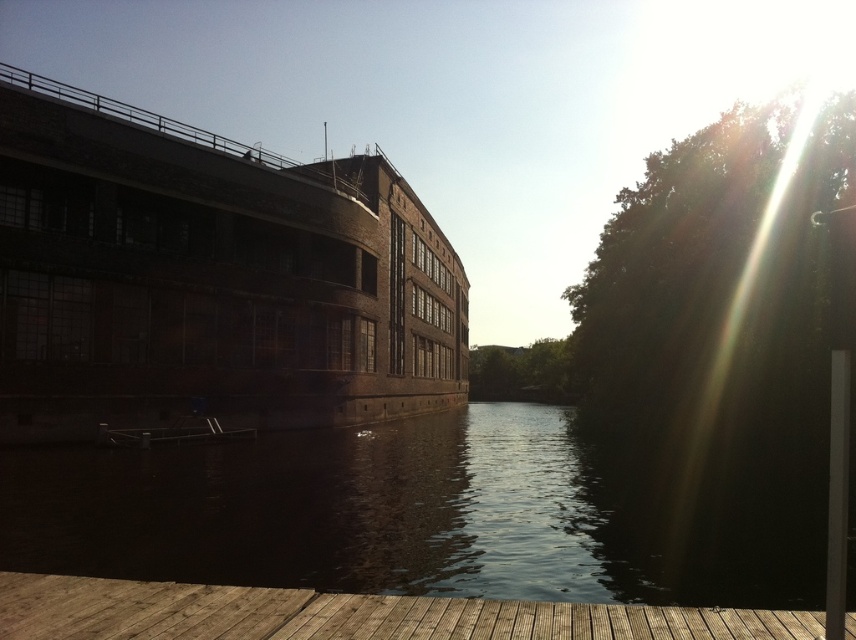
You are a photographer planning to capture the entire scene of the riverside building. You notice the dark reflective water at center and the wooden at lower left. Which object should you focus on to ensure the building is fully visible in your photo?

The dark reflective water at center has a larger size compared to wooden at lower left, so focusing on it would allow the building to be fully visible as it occupies more of the frame.

You are standing on the wooden at lower left and want to walk to the dark reflective water at center. Which direction should you move to reach it?

The dark reflective water at center has a greater height compared to wooden at lower left, so you should move upward to reach it.

You are standing at the riverside and want to toss a pebble into the dark reflective water at center. Considering the distance, can you estimate whether you can reach the water with an average throwing distance of 8 meters?

The dark reflective water at center is 7.56 meters away from the viewer, so yes, you can reach it with an average throwing distance of 8 meters.